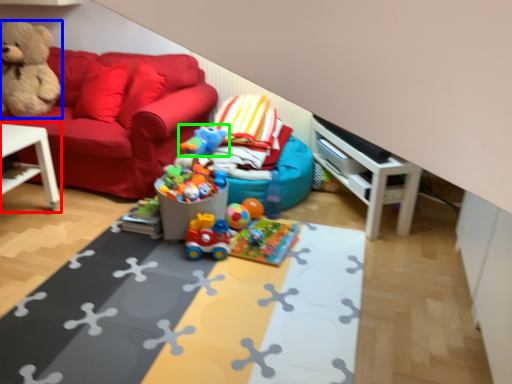
Question: Which is nearer to the table (highlighted by a red box)? teddy bear (highlighted by a blue box) or toy (highlighted by a green box).

Choices:
 (A) teddy bear
 (B) toy

Answer: (A)